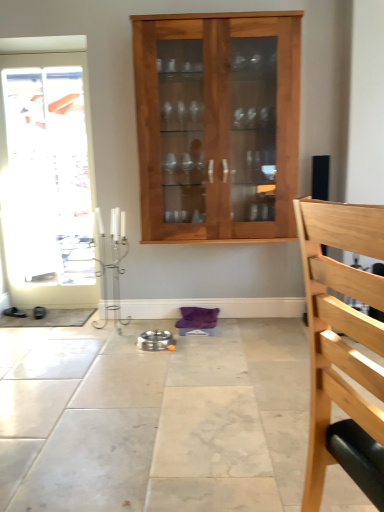
Question: From a real-world perspective, is light wood chair at right located beneath black leather shoes at lower left?

Choices:
 (A) yes
 (B) no

Answer: (B)

Question: Is light wood chair at right oriented towards black leather shoes at lower left?

Choices:
 (A) no
 (B) yes

Answer: (A)

Question: From a real-world perspective, is light wood chair at right on top of black leather shoes at lower left?

Choices:
 (A) no
 (B) yes

Answer: (B)

Question: Is light wood chair at right taller than black leather shoes at lower left?

Choices:
 (A) yes
 (B) no

Answer: (A)

Question: Is light wood chair at right shorter than black leather shoes at lower left?

Choices:
 (A) no
 (B) yes

Answer: (A)

Question: From a real-world perspective, is black leather shoes at lower left positioned above or below white glossy door at left?

Choices:
 (A) below
 (B) above

Answer: (A)

Question: Looking at their shapes, would you say black leather shoes at lower left is wider or thinner than white glossy door at left?

Choices:
 (A) wide
 (B) thin

Answer: (A)

Question: From the image's perspective, is black leather shoes at lower left located above or below white glossy door at left?

Choices:
 (A) above
 (B) below

Answer: (B)

Question: Based on their positions, is black leather shoes at lower left located to the left or right of white glossy door at left?

Choices:
 (A) left
 (B) right

Answer: (A)

Question: Do you think light brown wood cabinet at center is within black leather shoes at lower left, or outside of it?

Choices:
 (A) outside
 (B) inside

Answer: (A)

Question: From the image's perspective, is light brown wood cabinet at center positioned above or below black leather shoes at lower left?

Choices:
 (A) above
 (B) below

Answer: (A)

Question: In the image, is light brown wood cabinet at center on the left side or the right side of black leather shoes at lower left?

Choices:
 (A) right
 (B) left

Answer: (A)

Question: Does point (261, 27) appear closer or farther from the camera than point (16, 314)?

Choices:
 (A) farther
 (B) closer

Answer: (B)

Question: From the image's perspective, is light brown wood cabinet at center positioned above or below light wood chair at right?

Choices:
 (A) below
 (B) above

Answer: (B)

Question: Looking at their shapes, would you say light brown wood cabinet at center is wider or thinner than light wood chair at right?

Choices:
 (A) wide
 (B) thin

Answer: (A)